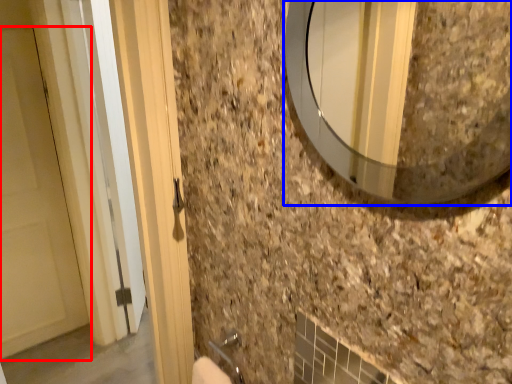
Question: Which point is further to the camera, door (highlighted by a red box) or mirror (highlighted by a blue box)?

Choices:
 (A) door
 (B) mirror

Answer: (A)